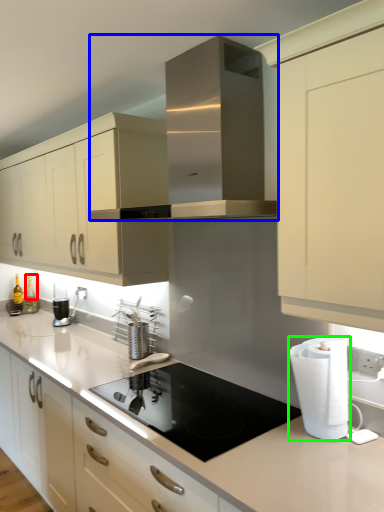
Question: Estimate the real-world distances between objects in this image. Which object is farther from bottle (highlighted by a red box), home appliance (highlighted by a blue box) or paper towel (highlighted by a green box)?

Choices:
 (A) home appliance
 (B) paper towel

Answer: (B)